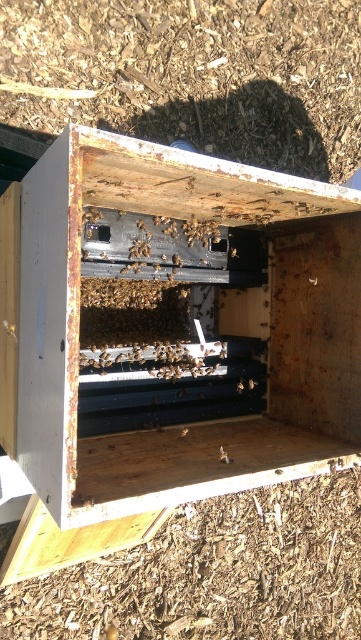
You are a beekeeper examining the hive and notice a translucent yellowish bee at center and a translucent yellowish honeycomb at center. Which object is closer to your face?

The translucent yellowish bee at center is closer to the viewer than the translucent yellowish honeycomb at center.

You are a beekeeper trying to inspect the hive. You notice the rusty metal beehive at center and the translucent yellowish honeycomb at center. Which object takes up more space in the hive?

The rusty metal beehive at center is bigger than the translucent yellowish honeycomb at center, so the rusty metal beehive at center takes up more space in the hive.

You are a beekeeper who needs to place a new wooden frame into the hive. The frame is 32 inches wide. Can you fit it between the rusty metal beehive at center and the nearest wooden frame inside?

The distance between the rusty metal beehive at center and the nearest wooden frame inside is 32.58 inches. Since the frame is 32 inches wide, it will fit with a small gap remaining.